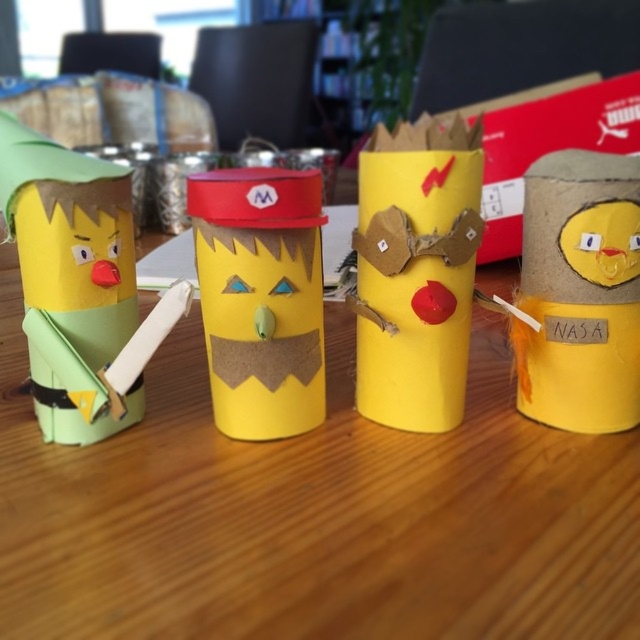
Question: Is yellow cardboard tubes at center thinner than yellow cardboard cup at center?

Choices:
 (A) no
 (B) yes

Answer: (A)

Question: Is yellow cardboard tubes at center positioned in front of yellow cardboard tube at right?

Choices:
 (A) yes
 (B) no

Answer: (A)

Question: Among these objects, which one is nearest to the camera?

Choices:
 (A) yellow cardboard tube at right
 (B) yellow cardboard tubes at center
 (C) yellow cardboard cup at center

Answer: (B)

Question: In this image, where is yellow cardboard tubes at center located relative to yellow cardboard cup at center?

Choices:
 (A) below
 (B) above

Answer: (B)

Question: Which of the following is the farthest from the observer?

Choices:
 (A) yellow cardboard tubes at center
 (B) yellow cardboard tube at right
 (C) yellow cardboard cup at center

Answer: (B)

Question: Which object is the closest to the yellow cardboard cup at center?

Choices:
 (A) yellow cardboard tubes at center
 (B) yellow cardboard tube at right

Answer: (A)